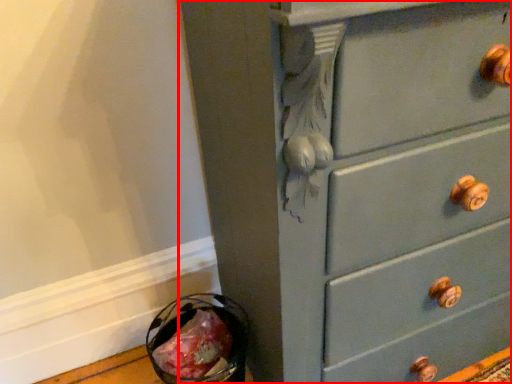
Question: From the image's perspective, where is chest of drawers (annotated by the red box) located in relation to food in the image?

Choices:
 (A) above
 (B) below

Answer: (A)